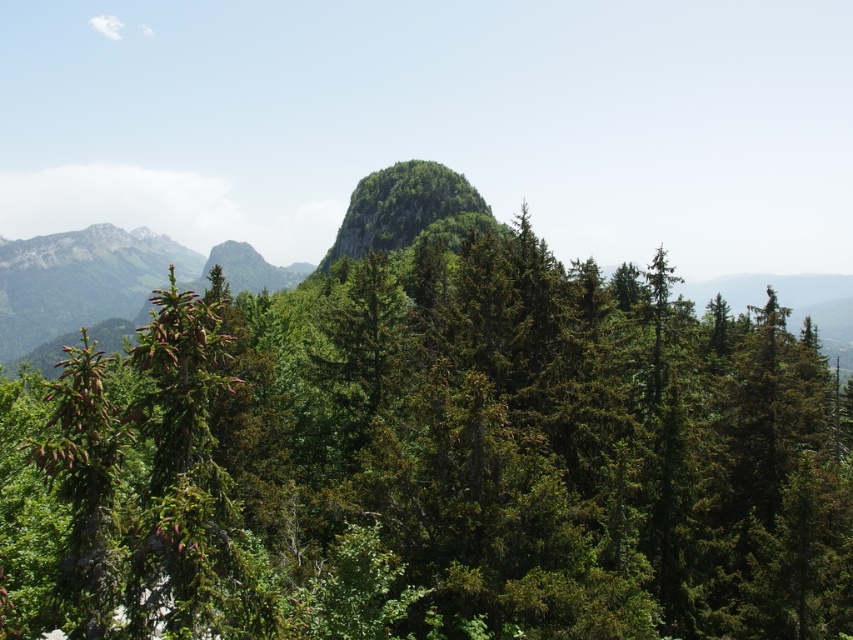
Question: Which of the following is the farthest from the observer?

Choices:
 (A) green leafy peak at center
 (B) green leafy mountain at left
 (C) green matte tree at center

Answer: (B)

Question: Which point is farther to the camera?

Choices:
 (A) (51, 339)
 (B) (378, 204)

Answer: (A)

Question: Is green leafy mountain at left to the right of green leafy peak at center from the viewer's perspective?

Choices:
 (A) no
 (B) yes

Answer: (A)

Question: Does green matte tree at center come behind green leafy mountain at left?

Choices:
 (A) no
 (B) yes

Answer: (A)

Question: Is green matte tree at center above green leafy peak at center?

Choices:
 (A) yes
 (B) no

Answer: (B)

Question: Estimate the real-world distances between objects in this image. Which object is farther from the green leafy mountain at left?

Choices:
 (A) green matte tree at center
 (B) green leafy peak at center

Answer: (A)